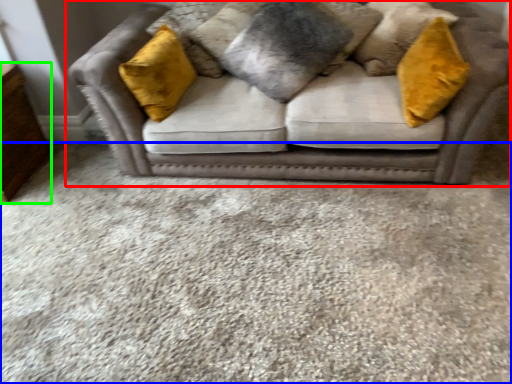
Question: Which is nearer to the studio couch (highlighted by a red box)? plain (highlighted by a blue box) or dresser (highlighted by a green box).

Choices:
 (A) plain
 (B) dresser

Answer: (A)